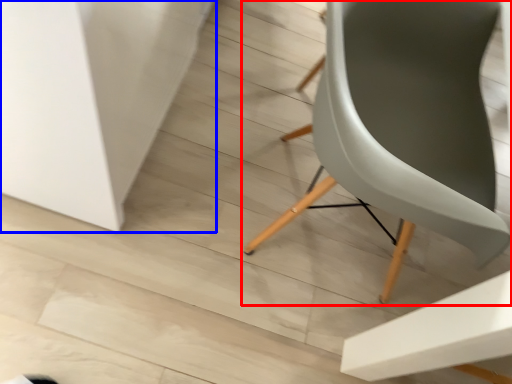
Question: Which of the following is the farthest to the observer, chair (highlighted by a red box) or table (highlighted by a blue box)?

Choices:
 (A) chair
 (B) table

Answer: (B)